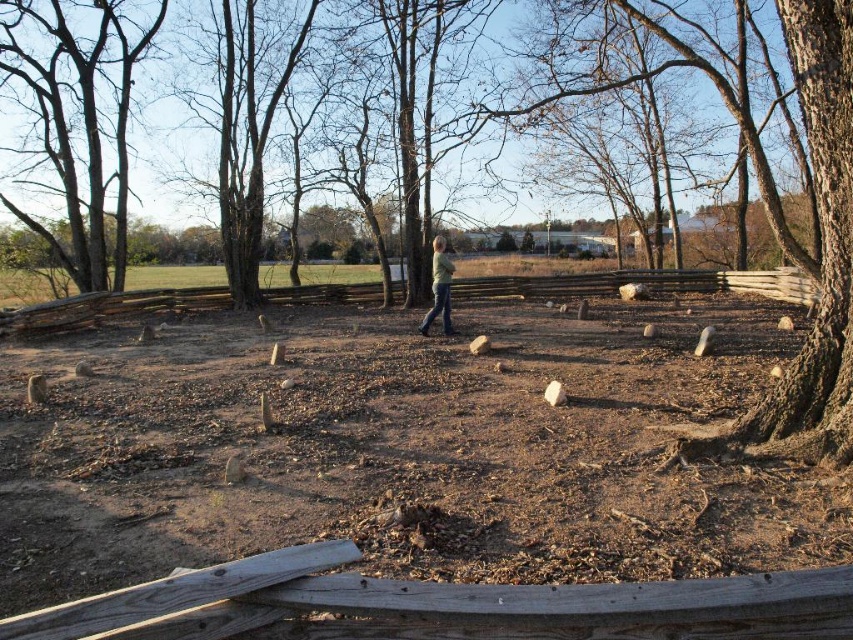
Question: Where is smooth gray bark at upper left located in relation to green matte jacket at center in the image?

Choices:
 (A) right
 (B) left

Answer: (B)

Question: Does brown dirt field at center appear on the left side of smooth gray bark at upper left?

Choices:
 (A) no
 (B) yes

Answer: (A)

Question: Which object is closer to the camera taking this photo?

Choices:
 (A) smooth gray bark at upper left
 (B) brown dirt field at center

Answer: (B)

Question: Which point is farther to the camera?

Choices:
 (A) (x=378, y=637)
 (B) (x=440, y=285)
 (C) (x=93, y=280)

Answer: (C)

Question: Which point appears farthest from the camera in this image?

Choices:
 (A) (718, 340)
 (B) (83, 276)

Answer: (B)

Question: From the image, what is the correct spatial relationship of smooth gray bark at upper left in relation to green matte jacket at center?

Choices:
 (A) right
 (B) left

Answer: (B)